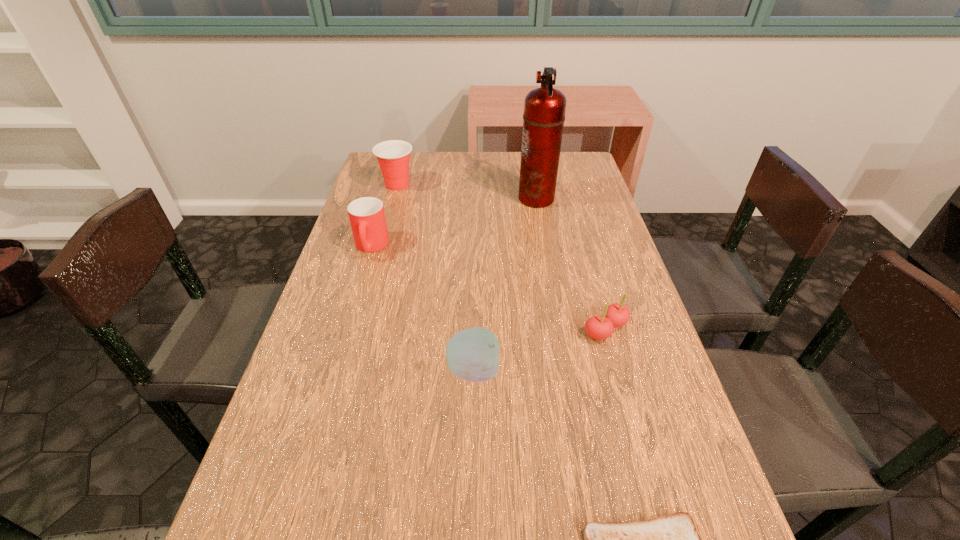
Locate an element on the screen. This screenshot has height=540, width=960. free location located 0.070m on the back of the farther cup is located at coordinates (402, 166).

Identify the location of free spot located on the side of the fourth nearest object with the handle. (363, 274).

The image size is (960, 540). Find the location of `free space located 0.250m on the right of the second nearest object`. free space located 0.250m on the right of the second nearest object is located at coordinates 619,370.

Locate an element on the screen. Image resolution: width=960 pixels, height=540 pixels. free location located on the front of the cherry is located at coordinates (625, 402).

Image resolution: width=960 pixels, height=540 pixels. Find the location of `object at the far edge`. object at the far edge is located at coordinates (393, 156).

Where is `fire extinguisher that is positioned at the right edge`? fire extinguisher that is positioned at the right edge is located at coordinates (544, 109).

Where is `cherry that is at the right edge`? This screenshot has width=960, height=540. cherry that is at the right edge is located at coordinates (615, 315).

What are the coordinates of `object at the far left corner` in the screenshot? It's located at (393, 156).

Locate an element on the screen. vacant space at the far edge of the desktop is located at coordinates (468, 178).

The height and width of the screenshot is (540, 960). Identify the location of vacant space at the left edge of the desktop. (377, 255).